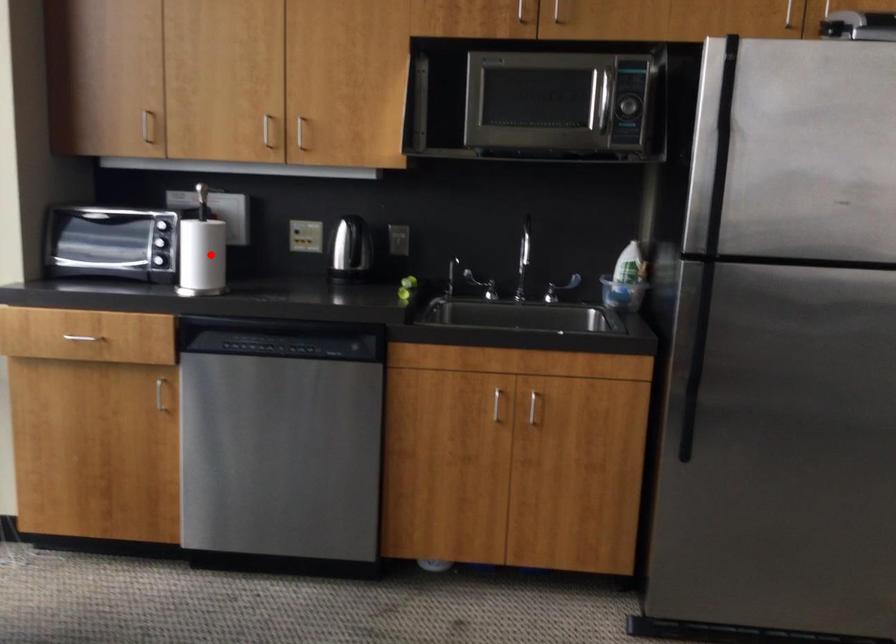
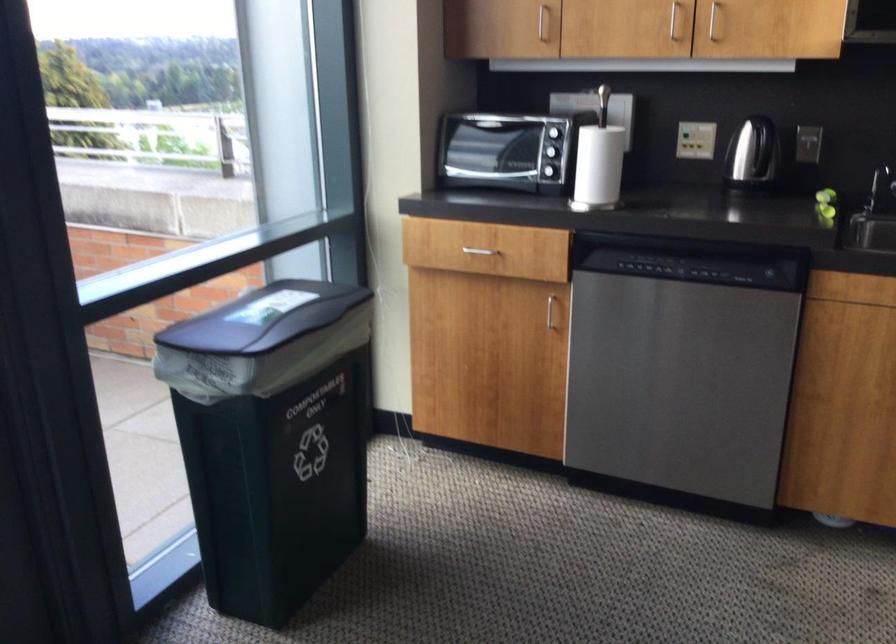
Find the pixel in the second image that matches the highlighted location in the first image.

(599, 165)